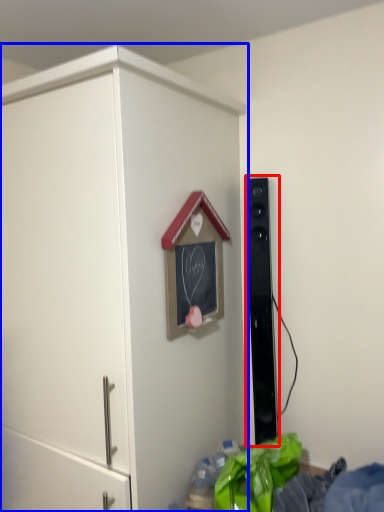
Question: Which object is closer to the camera taking this photo, speaker (highlighted by a red box) or cupboard (highlighted by a blue box)?

Choices:
 (A) speaker
 (B) cupboard

Answer: (B)